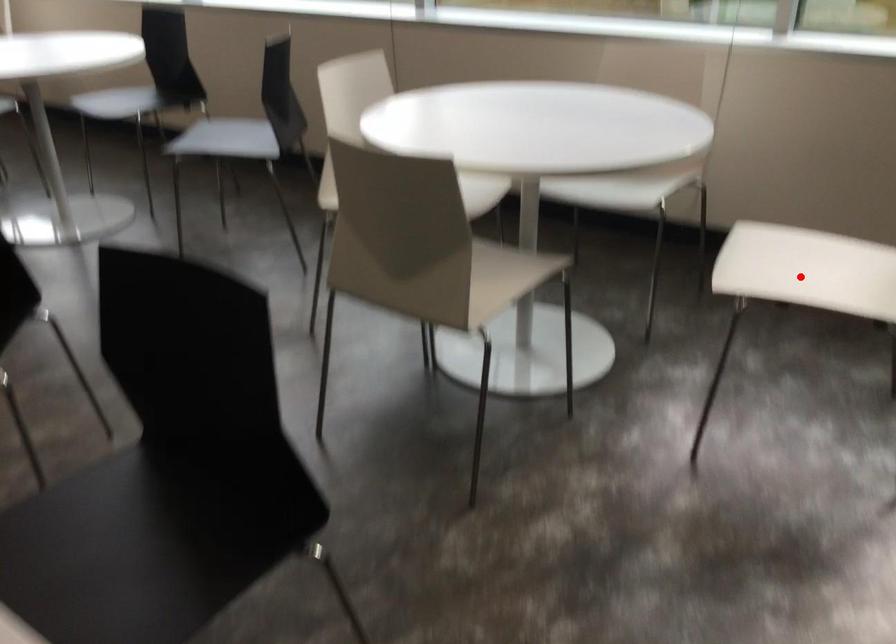
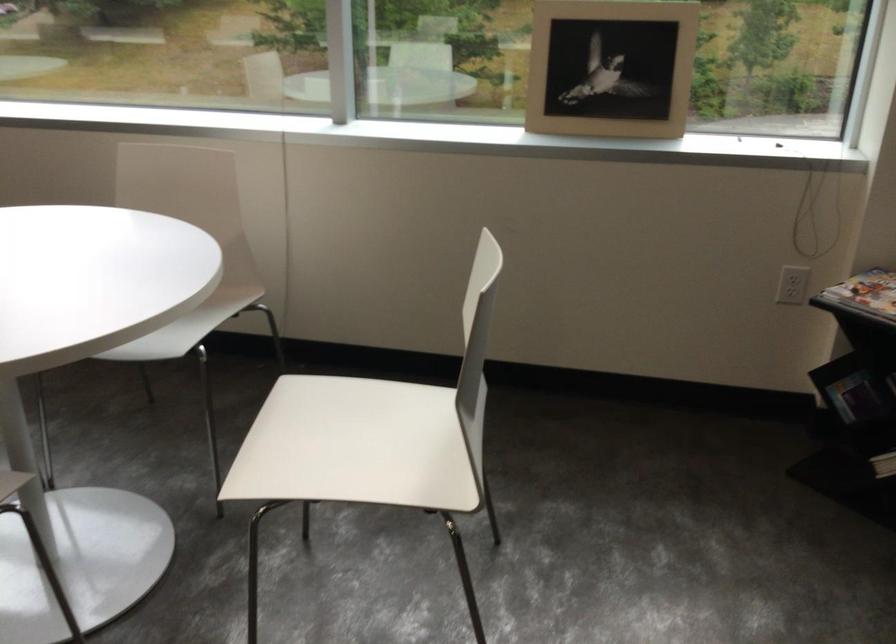
Question: I am providing you with two images of the same scene from different viewpoints. In image1, a red point is highlighted. Considering the same 3D point in image2, which of the following is correct?

Choices:
 (A) It is closer
 (B) It is farther

Answer: (A)